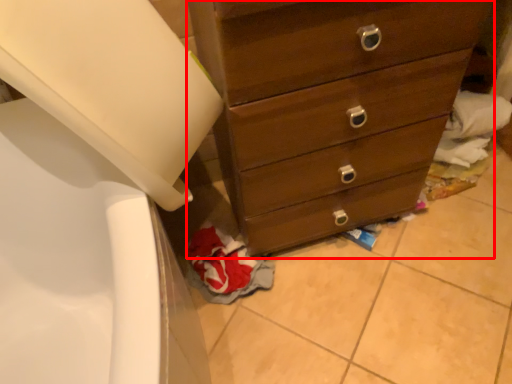
Question: Where is chest of drawers (annotated by the red box) located in relation to material in the image?

Choices:
 (A) right
 (B) left

Answer: (A)